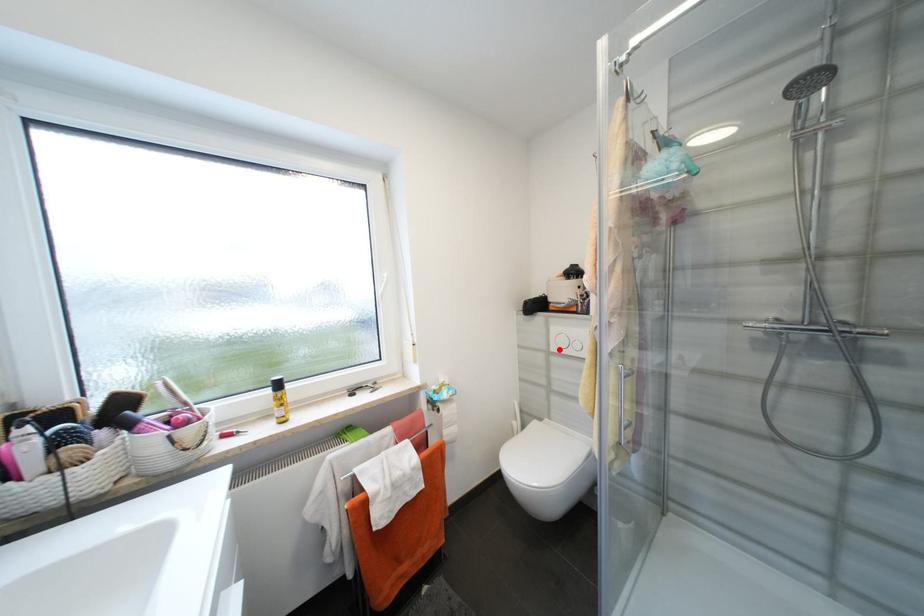
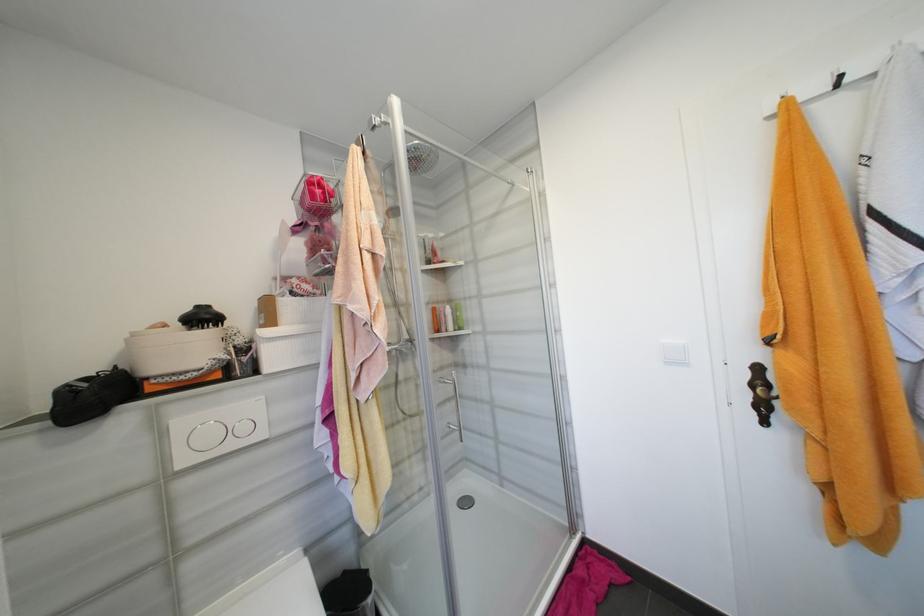
In the second image, find the point that corresponds to the highlighted location in the first image.

(189, 463)